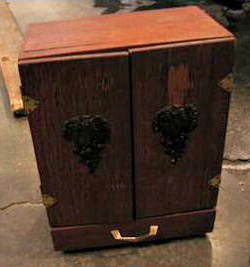
You are a GUI agent. You are given a task and a screenshot of the screen. Output one action in this format:
    pyautogui.click(x=<x>, y=<y>)
    Task: Click on the cabinet top
    This screenshot has width=250, height=267.
    Given the screenshot: What is the action you would take?
    pyautogui.click(x=119, y=25)